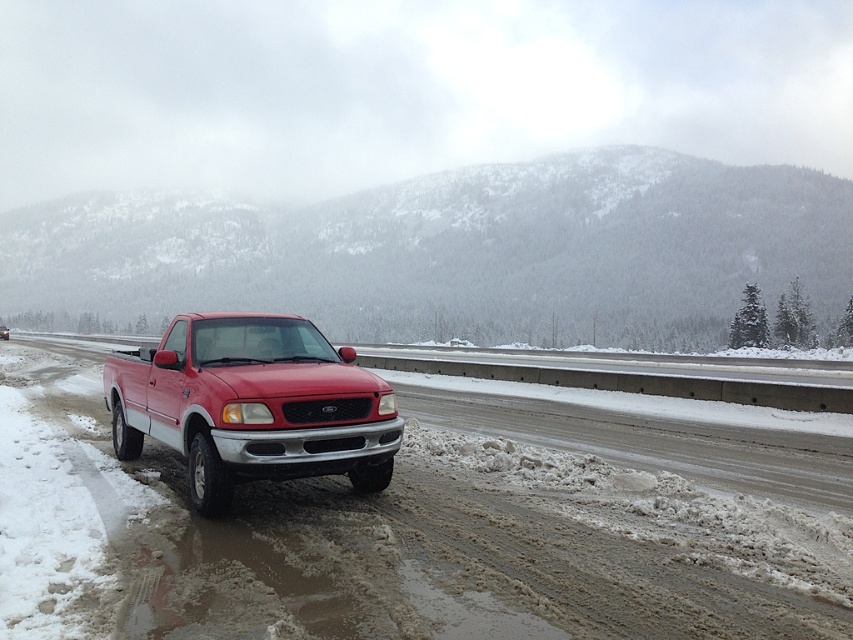
Question: Among these points, which one is nearest to the camera?

Choices:
 (A) (320, 337)
 (B) (373, 609)
 (C) (712, 380)

Answer: (B)

Question: Can you confirm if snowy forested mountain at upper center is thinner than matte red pickup truck at center?

Choices:
 (A) no
 (B) yes

Answer: (A)

Question: Which is farther from the snowy forested mountain at upper center?

Choices:
 (A) matte red pickup truck at center
 (B) slick rubber tire at center
 (C) glossy red truck at center

Answer: (A)

Question: Does slick rubber tire at center appear under snowy forested mountain at upper center?

Choices:
 (A) yes
 (B) no

Answer: (A)

Question: Considering the relative positions of snowy forested mountain at upper center and matte red pickup truck at center in the image provided, where is snowy forested mountain at upper center located with respect to matte red pickup truck at center?

Choices:
 (A) above
 (B) below

Answer: (A)

Question: Which of the following is the farthest from the observer?

Choices:
 (A) glossy red truck at center
 (B) slick rubber tire at center
 (C) matte red pickup truck at center
 (D) snowy forested mountain at upper center

Answer: (D)